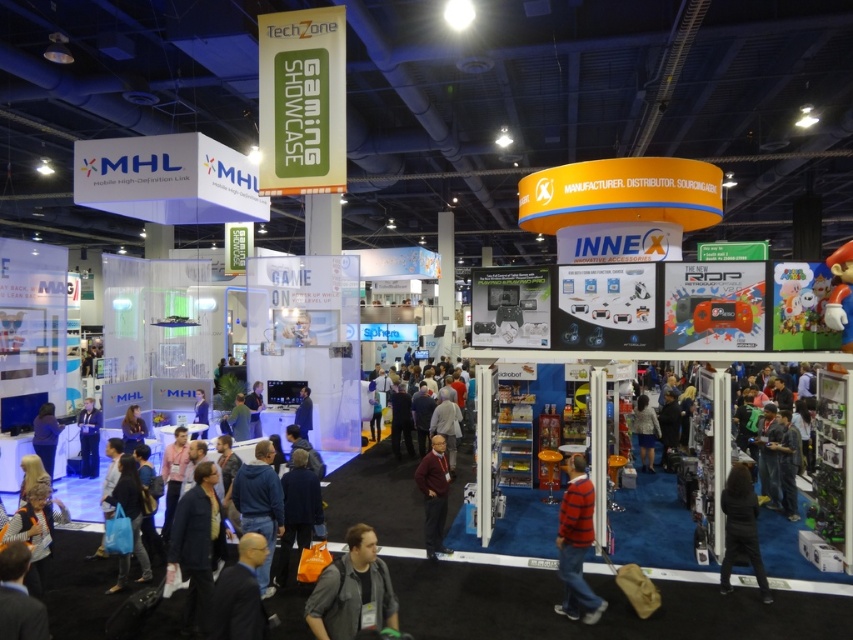
You are a convention attendee standing in the middle of the TechZone Gaming Showcase. You see a striped cotton shirt at center and a blue fabric skirt at center. Which clothing item is positioned higher up?

The striped cotton shirt at center is located above the blue fabric skirt at center, so it is positioned higher up.

You are a convention attendee standing at the entrance of the TechZone Gaming Showcase. You notice two shirts displayed at the INNEX booth in the center. The matte blue shirt at center and the dark blue shirt at center. If you want to pick up both shirts, which one should you reach for first to minimize your movement?

The matte blue shirt at center is 9.86 feet away from the dark blue shirt at center. To minimize movement, you should reach for whichever shirt is closer to your current position. However, since the distance between them is fixed, you might want to grab the one closer to you first and then the other.

You are an event organizer at the TechZone Gaming Showcase. You need to determine which blue fabric item is more suitable for covering a large promotional stand. Which one between the blue fabric skirt at center and the blue fabric at center should you choose?

The blue fabric skirt at center has a larger size compared to the blue fabric at center, so it is more suitable for covering a large promotional stand.